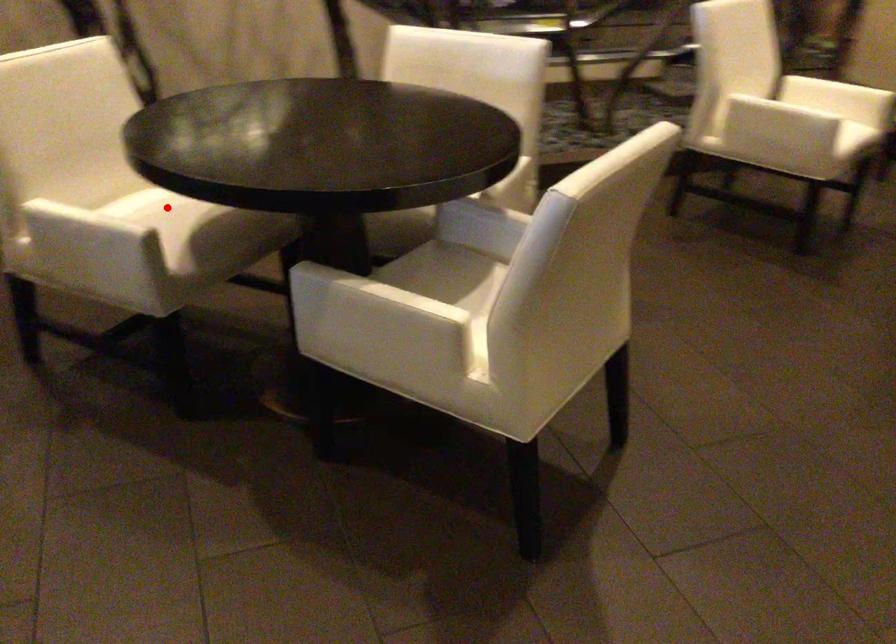
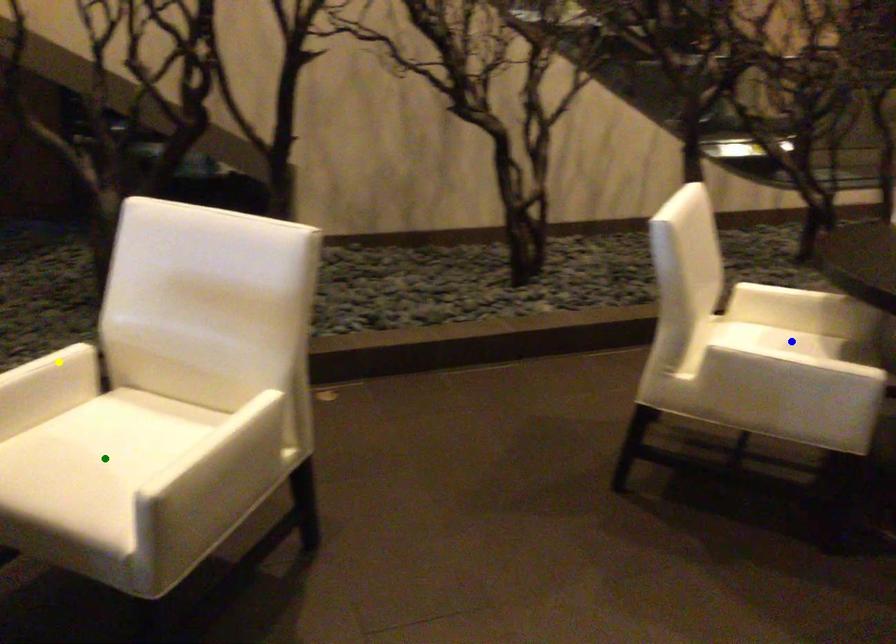
Question: I am providing you with two images of the same scene from different viewpoints. A red point is marked on the first image. You are given multiple points on the second image. Which point in image 2 is actually the same real-world point as the red point in image 1?

Choices:
 (A) green point
 (B) blue point
 (C) yellow point

Answer: (B)